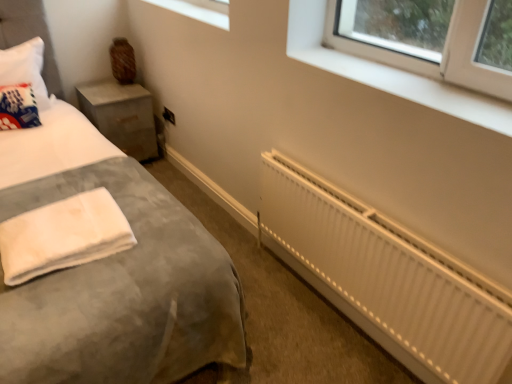
The image size is (512, 384). Find the location of `concrete textured nightstand at left`. concrete textured nightstand at left is located at coordinates (121, 115).

What do you see at coordinates (18, 107) in the screenshot?
I see `white fabric throw pillow at left` at bounding box center [18, 107].

Consider the image. In order to face translucent glass window at upper center, which is counted as the first window, starting from the back, should I rotate leftwards or rightwards?

Rotate your view left by about 8.306°.

This screenshot has height=384, width=512. Identify the location of velvet grey bed at lower left. (124, 294).

The image size is (512, 384). What are the coordinates of `concrete textured nightstand at left` in the screenshot? It's located at (121, 115).

Is white metallic radiator at lower right turned away from white fluffy towel at lower left?

No, white metallic radiator at lower right is not facing away from white fluffy towel at lower left.

Which is nearer, (391, 227) or (76, 217)?

Point (391, 227)

From a real-world perspective, between white metallic radiator at lower right and white fluffy towel at lower left, who is vertically higher?

white fluffy towel at lower left, from a real-world perspective.

Considering the positions of objects white metallic radiator at lower right and white fluffy towel at lower left in the image provided, who is more to the right, white metallic radiator at lower right or white fluffy towel at lower left?

white metallic radiator at lower right is more to the right.

From the image's perspective, is white plastic window at upper right, which is the 1th window in bottom-to-top order, beneath white fabric throw pillow at left?

Yes.

Is white plastic window at upper right, which is the 1th window in bottom-to-top order, placed right next to white fabric throw pillow at left?

No, white plastic window at upper right, which is the 1th window in bottom-to-top order, is not touching white fabric throw pillow at left.

In the scene shown: Is white plastic window at upper right, the second window viewed from the left, positioned with its back to white fabric throw pillow at left?

No, white fabric throw pillow at left is not at the back of white plastic window at upper right, the second window viewed from the left.

Which is more to the right, white plastic window at upper right, marked as the first window in a front-to-back arrangement, or white fabric throw pillow at left?

white plastic window at upper right, marked as the first window in a front-to-back arrangement, is more to the right.

From the picture: How many degrees apart are the facing directions of translucent glass window at upper center, which is the second window in bottom-to-top order, and white plastic window at upper right, the second window positioned from the back?

The angular difference between translucent glass window at upper center, which is the second window in bottom-to-top order, and white plastic window at upper right, the second window positioned from the back, is 1.11 degrees.

Considering the positions of objects translucent glass window at upper center, marked as the 2th window in a front-to-back arrangement, and white plastic window at upper right, which is the 1th window in bottom-to-top order, in the image provided, who is more to the right, translucent glass window at upper center, marked as the 2th window in a front-to-back arrangement, or white plastic window at upper right, which is the 1th window in bottom-to-top order,?

Positioned to the right is white plastic window at upper right, which is the 1th window in bottom-to-top order.

Would you say translucent glass window at upper center, marked as the 2th window in a front-to-back arrangement, is inside or outside white plastic window at upper right, which is the 1th window in bottom-to-top order?

translucent glass window at upper center, marked as the 2th window in a front-to-back arrangement, is spatially situated outside white plastic window at upper right, which is the 1th window in bottom-to-top order.

Is translucent glass window at upper center, the 1th window positioned from the top, next to white plastic window at upper right, marked as the first window in a front-to-back arrangement?

No, translucent glass window at upper center, the 1th window positioned from the top, is not in contact with white plastic window at upper right, marked as the first window in a front-to-back arrangement.

Does white fluffy towel at lower left have a greater width compared to translucent glass window at upper center, which is the second window in bottom-to-top order?

Correct, the width of white fluffy towel at lower left exceeds that of translucent glass window at upper center, which is the second window in bottom-to-top order.

Is translucent glass window at upper center, the 1th window positioned from the top, a part of white fluffy towel at lower left?

No, white fluffy towel at lower left does not contain translucent glass window at upper center, the 1th window positioned from the top.

Does white fluffy towel at lower left have a lesser height compared to translucent glass window at upper center, which is the second window in bottom-to-top order?

Incorrect, the height of white fluffy towel at lower left does not fall short of that of translucent glass window at upper center, which is the second window in bottom-to-top order.

How different are the orientations of translucent glass window at upper center, which is counted as the first window, starting from the back, and velvet grey bed at lower left in degrees?

The facing directions of translucent glass window at upper center, which is counted as the first window, starting from the back, and velvet grey bed at lower left are 89.1 degrees apart.

Which point is more forward, (165,7) or (105,265)?

The point (105,265) is closer.

Is translucent glass window at upper center, the 1th window positioned from the top, not inside velvet grey bed at lower left?

Yes.

Is translucent glass window at upper center, which is counted as the first window, starting from the back, directly adjacent to velvet grey bed at lower left?

No.

Is white metallic radiator at lower right positioned with its back to velvet grey bed at lower left?

No, velvet grey bed at lower left is not at the back of white metallic radiator at lower right.

Can you confirm if white metallic radiator at lower right is smaller than velvet grey bed at lower left?

Yes.

Is the position of white metallic radiator at lower right less distant than that of velvet grey bed at lower left?

No, the depth of white metallic radiator at lower right is greater than that of velvet grey bed at lower left.

Is white metallic radiator at lower right taller than velvet grey bed at lower left?

No.

Considering the points (9, 266) and (300, 19), which point is behind, point (9, 266) or point (300, 19)?

Point (300, 19)

Is white plastic window at upper right, placed as the 2th window when sorted from top to bottom, at the back of white fluffy towel at lower left?

No, white fluffy towel at lower left is not facing the opposite direction of white plastic window at upper right, placed as the 2th window when sorted from top to bottom.

Between white fluffy towel at lower left and white plastic window at upper right, placed as the 2th window when sorted from top to bottom, which one appears on the left side from the viewer's perspective?

From the viewer's perspective, white fluffy towel at lower left appears more on the left side.

Choose the correct answer: Is white fluffy towel at lower left inside white plastic window at upper right, marked as the first window in a front-to-back arrangement, or outside it?

white fluffy towel at lower left cannot be found inside white plastic window at upper right, marked as the first window in a front-to-back arrangement.

Identify the location of cloth that is above the white metallic radiator at lower right (from the image's perspective). The height and width of the screenshot is (384, 512). (63, 235).

This screenshot has height=384, width=512. I want to click on throw pillow lying on the left of white plastic window at upper right, which is counted as the first window, starting from the right, so click(x=18, y=107).

From the image, which object appears to be farther from white metallic radiator at lower right, white fabric throw pillow at left or translucent glass window at upper center, the 1th window positioned from the top?

white fabric throw pillow at left.

Considering their positions, is white plastic window at upper right, the second window viewed from the left, positioned closer to velvet grey bed at lower left than white metallic radiator at lower right?

Among the two, white metallic radiator at lower right is located nearer to velvet grey bed at lower left.

From the image, which object appears to be nearer to translucent glass window at upper center, marked as the 2th window in a front-to-back arrangement, white fluffy towel at lower left or velvet grey bed at lower left?

velvet grey bed at lower left is closer to translucent glass window at upper center, marked as the 2th window in a front-to-back arrangement.

Based on their spatial positions, is white fluffy towel at lower left or translucent glass window at upper center, the 1th window positioned from the top, further from concrete textured nightstand at left?

white fluffy towel at lower left is positioned further to the anchor concrete textured nightstand at left.

Looking at the image, which one is located further to translucent glass window at upper center, the second window when ordered from right to left, velvet grey bed at lower left or concrete textured nightstand at left?

velvet grey bed at lower left lies further to translucent glass window at upper center, the second window when ordered from right to left, than the other object.

Which object lies further to the anchor point white fabric throw pillow at left, concrete textured nightstand at left or translucent glass window at upper center, the 1th window positioned from the top?

The object further to white fabric throw pillow at left is translucent glass window at upper center, the 1th window positioned from the top.

Based on their spatial positions, is white metallic radiator at lower right or concrete textured nightstand at left closer to white fluffy towel at lower left?

Based on the image, white metallic radiator at lower right appears to be nearer to white fluffy towel at lower left.

Considering their positions, is white plastic window at upper right, which is counted as the first window, starting from the right, positioned closer to white fabric throw pillow at left than concrete textured nightstand at left?

concrete textured nightstand at left is positioned closer to the anchor white fabric throw pillow at left.

Find the location of a particular element. This screenshot has width=512, height=384. cloth between velvet grey bed at lower left and white plastic window at upper right, placed as the 2th window when sorted from top to bottom is located at coordinates (63, 235).

Image resolution: width=512 pixels, height=384 pixels. What are the coordinates of `throw pillow between translucent glass window at upper center, marked as the 2th window in a front-to-back arrangement, and white fluffy towel at lower left in the up-down direction` in the screenshot? It's located at (18, 107).

Locate an element on the screen. cloth between white metallic radiator at lower right and concrete textured nightstand at left in the front-back direction is located at coordinates (63, 235).

Locate an element on the screen. window between white fluffy towel at lower left and white plastic window at upper right, placed as the 2th window when sorted from top to bottom, in the horizontal direction is located at coordinates (199, 10).